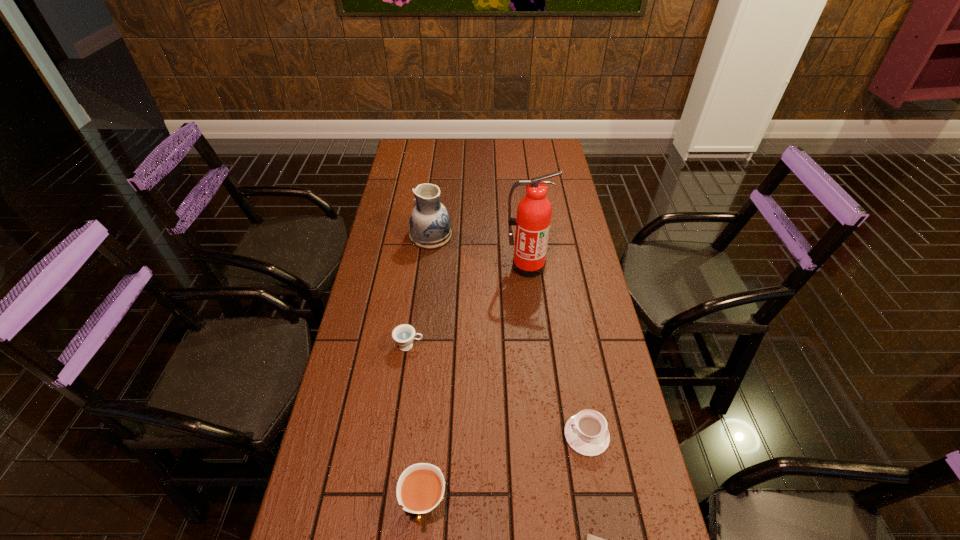
Find the location of `vacant space at the left edge of the desktop`. vacant space at the left edge of the desktop is located at coordinates (404, 169).

Image resolution: width=960 pixels, height=540 pixels. What are the coordinates of `vacant space at the right edge of the desktop` in the screenshot? It's located at (585, 278).

Locate an element on the screen. vacant space at the far left corner of the desktop is located at coordinates [x=407, y=147].

Image resolution: width=960 pixels, height=540 pixels. Identify the location of vacant space in between the farthest teacup and the pottery. (420, 291).

The height and width of the screenshot is (540, 960). I want to click on unoccupied area between the rightmost teacup and the tallest object, so click(557, 350).

Where is `vacant space in between the fifth nearest object and the third farthest object`? Image resolution: width=960 pixels, height=540 pixels. vacant space in between the fifth nearest object and the third farthest object is located at coordinates (468, 306).

Image resolution: width=960 pixels, height=540 pixels. I want to click on free space that is in between the third nearest object and the fourth nearest object, so click(498, 390).

This screenshot has height=540, width=960. Identify the location of free space between the fourth shortest object and the farthest teacup. (417, 426).

You are a GUI agent. You are given a task and a screenshot of the screen. Output one action in this format:
    pyautogui.click(x=<x>, y=<y>)
    Task: Click on the free space between the tallest teacup and the second nearest teacup
    The height and width of the screenshot is (540, 960).
    Given the screenshot: What is the action you would take?
    pyautogui.click(x=505, y=470)

The image size is (960, 540). Identify the location of object that is the fifth closest one to the fifth nearest object. (591, 539).